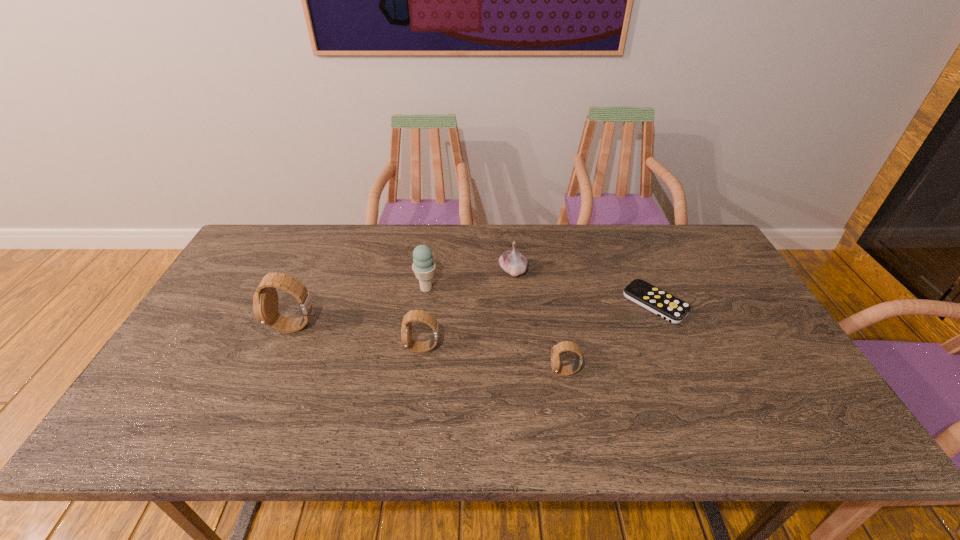
This screenshot has height=540, width=960. In order to click on the leftmost watch in this screenshot , I will do `click(265, 300)`.

The image size is (960, 540). I want to click on the leftmost object, so click(265, 300).

The height and width of the screenshot is (540, 960). Identify the location of the second watch from left to right. (414, 315).

Where is `the nearest watch`? The width and height of the screenshot is (960, 540). the nearest watch is located at coordinates (563, 346).

In order to click on the rightmost watch in this screenshot , I will do `click(563, 346)`.

Locate an element on the screen. This screenshot has height=540, width=960. remote control is located at coordinates 661,303.

Find the location of a particular element. This screenshot has width=960, height=540. the shortest object is located at coordinates (661, 303).

This screenshot has height=540, width=960. I want to click on ice cream, so click(423, 266).

The image size is (960, 540). I want to click on the fourth object from left to right, so click(513, 262).

Find the location of `garlic`. garlic is located at coordinates (513, 262).